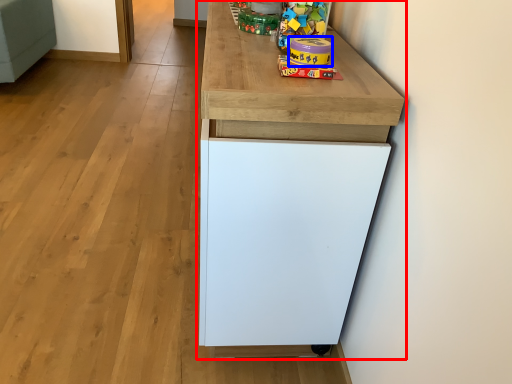
Question: Which object appears closest to the camera in this image, cabinetry (highlighted by a red box) or toy (highlighted by a blue box)?

Choices:
 (A) cabinetry
 (B) toy

Answer: (A)